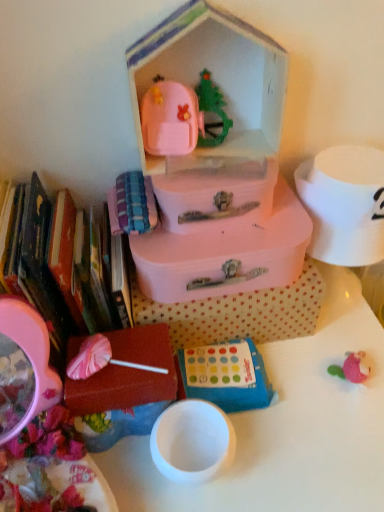
The height and width of the screenshot is (512, 384). Find the location of `spots to the right of blue fabric game at center`. spots to the right of blue fabric game at center is located at coordinates (319, 388).